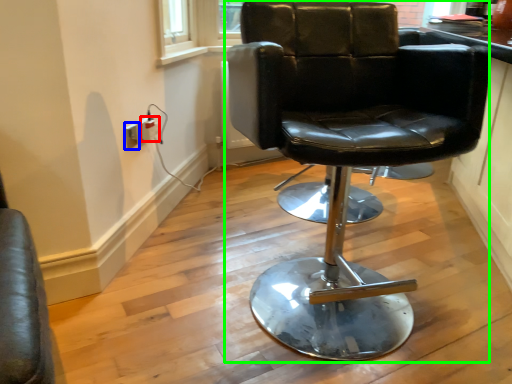
Question: Considering the real-world distances, which object is closest to electric outlet (highlighted by a red box)? electric outlet (highlighted by a blue box) or chair (highlighted by a green box).

Choices:
 (A) electric outlet
 (B) chair

Answer: (A)